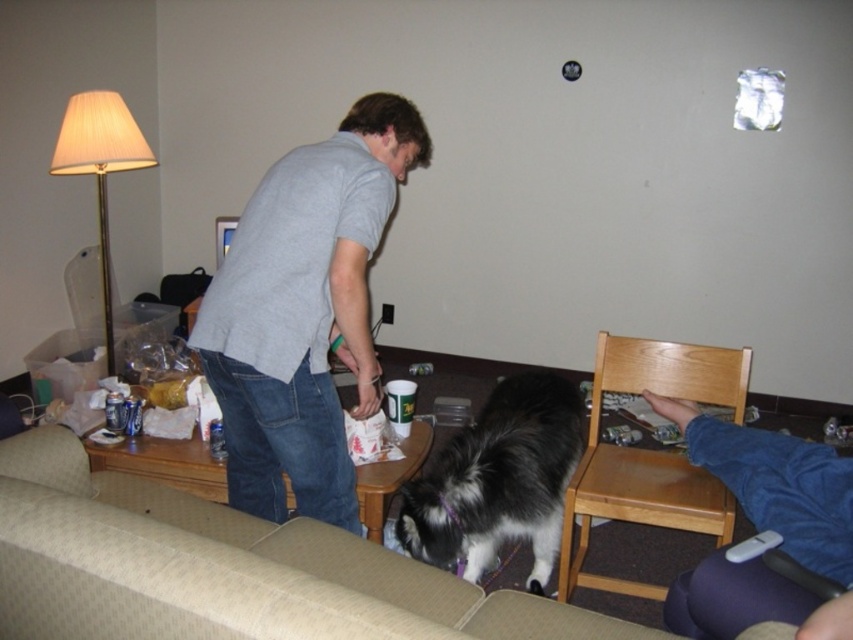
Which of these two, beige fabric couch at lower left or wooden table at center, stands taller?

With more height is beige fabric couch at lower left.

Does beige fabric couch at lower left appear over wooden table at center?

Incorrect, beige fabric couch at lower left is not positioned above wooden table at center.

Does point (386, 589) come in front of point (387, 468)?

Yes, it is in front of point (387, 468).

Where is `beige fabric couch at lower left`? This screenshot has height=640, width=853. beige fabric couch at lower left is located at coordinates (223, 570).

Is gray cotton shirt at center bigger than black and white fur at center?

Yes.

Which is behind, point (376, 157) or point (431, 490)?

Positioned behind is point (431, 490).

Which is behind, point (335, 476) or point (503, 392)?

The point (503, 392) is behind.

Identify the location of gray cotton shirt at center. (305, 312).

Between beige fabric couch at lower left and gray cotton shirt at center, which one has more height?

With more height is gray cotton shirt at center.

Does beige fabric couch at lower left come in front of gray cotton shirt at center?

Yes, beige fabric couch at lower left is in front of gray cotton shirt at center.

Who is more forward, (213, 520) or (349, 490)?

Point (213, 520) is more forward.

Image resolution: width=853 pixels, height=640 pixels. Identify the location of beige fabric couch at lower left. (223, 570).